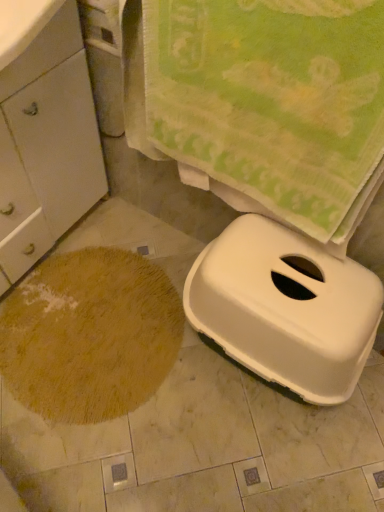
Question: Is white matte cabinet at left taller than brown shaggy rug at lower left?

Choices:
 (A) no
 (B) yes

Answer: (B)

Question: Is brown shaggy rug at lower left surrounded by white matte cabinet at left?

Choices:
 (A) no
 (B) yes

Answer: (A)

Question: Could you tell me if white matte cabinet at left is facing brown shaggy rug at lower left?

Choices:
 (A) yes
 (B) no

Answer: (A)

Question: Considering the relative sizes of white matte cabinet at left and brown shaggy rug at lower left in the image provided, is white matte cabinet at left thinner than brown shaggy rug at lower left?

Choices:
 (A) yes
 (B) no

Answer: (A)

Question: From the image's perspective, would you say white matte cabinet at left is shown under brown shaggy rug at lower left?

Choices:
 (A) no
 (B) yes

Answer: (A)

Question: Is white matte cabinet at left at the left side of brown shaggy rug at lower left?

Choices:
 (A) no
 (B) yes

Answer: (B)

Question: Considering the relative sizes of brown shaggy rug at lower left and white matte cabinet at left in the image provided, is brown shaggy rug at lower left smaller than white matte cabinet at left?

Choices:
 (A) no
 (B) yes

Answer: (B)

Question: Can you confirm if brown shaggy rug at lower left is positioned to the left of white matte cabinet at left?

Choices:
 (A) no
 (B) yes

Answer: (A)

Question: Considering the relative sizes of brown shaggy rug at lower left and white matte cabinet at left in the image provided, is brown shaggy rug at lower left shorter than white matte cabinet at left?

Choices:
 (A) yes
 (B) no

Answer: (A)

Question: Is white matte cabinet at left at the back of brown shaggy rug at lower left?

Choices:
 (A) yes
 (B) no

Answer: (B)

Question: Is the depth of brown shaggy rug at lower left greater than that of white matte cabinet at left?

Choices:
 (A) no
 (B) yes

Answer: (B)

Question: From a real-world perspective, is brown shaggy rug at lower left on white matte cabinet at left?

Choices:
 (A) yes
 (B) no

Answer: (B)

Question: From the image's perspective, is white plastic litter box at lower right under white matte cabinet at left?

Choices:
 (A) no
 (B) yes

Answer: (B)